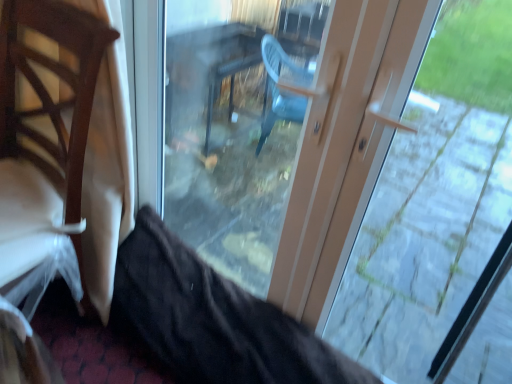
What do you see at coordinates (42, 175) in the screenshot? Image resolution: width=512 pixels, height=384 pixels. I see `wooden chair at left` at bounding box center [42, 175].

Where is `wooden chair at left`? The width and height of the screenshot is (512, 384). wooden chair at left is located at coordinates 42,175.

In terms of width, does wooden chair at left look wider or thinner when compared to transparent glass door at center?

wooden chair at left is wider than transparent glass door at center.

Consider the image. Is wooden chair at left looking in the opposite direction of transparent glass door at center?

No, wooden chair at left's orientation is not away from transparent glass door at center.

Is the depth of wooden chair at left greater than that of transparent glass door at center?

No, it is in front of transparent glass door at center.

Considering the relative sizes of wooden chair at left and matte plastic door at center in the image provided, is wooden chair at left smaller than matte plastic door at center?

Incorrect, wooden chair at left is not smaller in size than matte plastic door at center.

Is wooden chair at left positioned beyond the bounds of matte plastic door at center?

Indeed, wooden chair at left is completely outside matte plastic door at center.

From a real-world perspective, is wooden chair at left physically located above or below matte plastic door at center?

Clearly, from a real-world perspective, wooden chair at left is below matte plastic door at center.

Is wooden chair at left to the left or to the right of matte plastic door at center in the image?

In the image, wooden chair at left appears on the left side of matte plastic door at center.

Considering the relative positions of transparent glass door at center and matte plastic door at center in the image provided, is transparent glass door at center in front of matte plastic door at center?

No, transparent glass door at center is further to the viewer.

How different are the orientations of transparent glass door at center and matte plastic door at center in degrees?

The angular difference between transparent glass door at center and matte plastic door at center is 0.395 degrees.

Identify the location of glass door behind the matte plastic door at center. (234, 125).

Measure the distance from matte plastic door at center to wooden chair at left.

matte plastic door at center is 1.19 meters away from wooden chair at left.

Is matte plastic door at center closer to camera compared to wooden chair at left?

Yes.

Consider the image. Considering the relative sizes of matte plastic door at center and wooden chair at left in the image provided, is matte plastic door at center smaller than wooden chair at left?

Yes.

Based on the photo, are matte plastic door at center and wooden chair at left located far from each other?

Yes, matte plastic door at center is far from wooden chair at left.

In terms of height, does matte plastic door at center look taller or shorter compared to transparent glass door at center?

Clearly, matte plastic door at center is taller compared to transparent glass door at center.

Is matte plastic door at center positioned before transparent glass door at center?

Yes, the depth of matte plastic door at center is less than that of transparent glass door at center.

Measure the distance from matte plastic door at center to transparent glass door at center.

The distance of matte plastic door at center from transparent glass door at center is 18.04 inches.

Would you say transparent glass door at center is part of matte plastic door at center's contents?

Absolutely, transparent glass door at center is inside matte plastic door at center.

Is transparent glass door at center positioned with its back to wooden chair at left?

transparent glass door at center is not turned away from wooden chair at left.

Are transparent glass door at center and wooden chair at left making contact?

No, transparent glass door at center is not touching wooden chair at left.

Is transparent glass door at center inside the boundaries of wooden chair at left, or outside?

transparent glass door at center is not inside wooden chair at left, it's outside.

Is transparent glass door at center at the right side of wooden chair at left?

Correct, you'll find transparent glass door at center to the right of wooden chair at left.

Find the location of `chair located underneath the transparent glass door at center (from a real-world perspective)`. chair located underneath the transparent glass door at center (from a real-world perspective) is located at coordinates (42, 175).

Identify the location of chair below the matte plastic door at center (from the image's perspective). The width and height of the screenshot is (512, 384). (42, 175).

Looking at the image, which one is located further to transparent glass door at center, wooden chair at left or matte plastic door at center?

The object further to transparent glass door at center is wooden chair at left.

Considering their positions, is transparent glass door at center positioned further to matte plastic door at center than wooden chair at left?

Among the two, wooden chair at left is located further to matte plastic door at center.

When comparing their distances from wooden chair at left, does transparent glass door at center or matte plastic door at center seem closer?

The object closer to wooden chair at left is transparent glass door at center.

From the image, which object appears to be nearer to matte plastic door at center, wooden chair at left or transparent glass door at center?

transparent glass door at center is positioned closer to the anchor matte plastic door at center.

Considering their positions, is matte plastic door at center positioned further to wooden chair at left than transparent glass door at center?

The object further to wooden chair at left is matte plastic door at center.

Considering their positions, is matte plastic door at center positioned further to transparent glass door at center than wooden chair at left?

wooden chair at left lies further to transparent glass door at center than the other object.

Identify the location of glass door located between wooden chair at left and matte plastic door at center in the left-right direction. (234, 125).